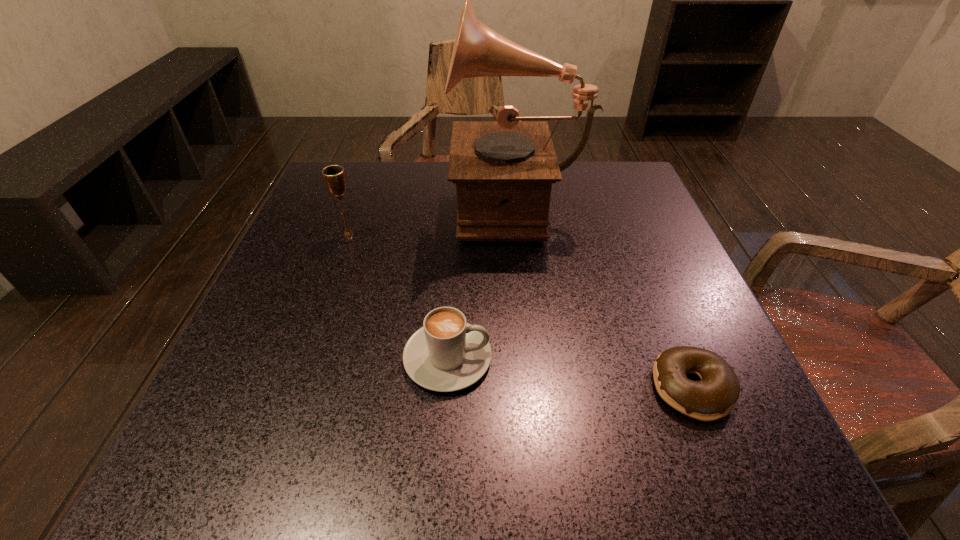
Find the location of `record player`. record player is located at coordinates (503, 170).

The image size is (960, 540). I want to click on the leftmost object, so click(334, 176).

Where is `chalice`? This screenshot has height=540, width=960. chalice is located at coordinates (334, 176).

At what (x,y) coordinates should I click in order to perform the action: click on the second shortest object. Please return your answer as a coordinate pair (x, y). The image size is (960, 540). Looking at the image, I should click on (447, 354).

Find the location of `doughnut`. doughnut is located at coordinates (714, 397).

In order to click on the rightmost object in this screenshot , I will do `click(714, 397)`.

Locate an element on the screen. The height and width of the screenshot is (540, 960). vacant space situated on the horn of the record player is located at coordinates (315, 202).

Locate an element on the screen. free space located 0.180m on the horn of the record player is located at coordinates (374, 202).

The width and height of the screenshot is (960, 540). What are the coordinates of `free point located 0.160m on the horn of the record player` in the screenshot? It's located at (383, 202).

Locate an element on the screen. The image size is (960, 540). vacant space situated 0.110m on the front of the third shortest object is located at coordinates (334, 276).